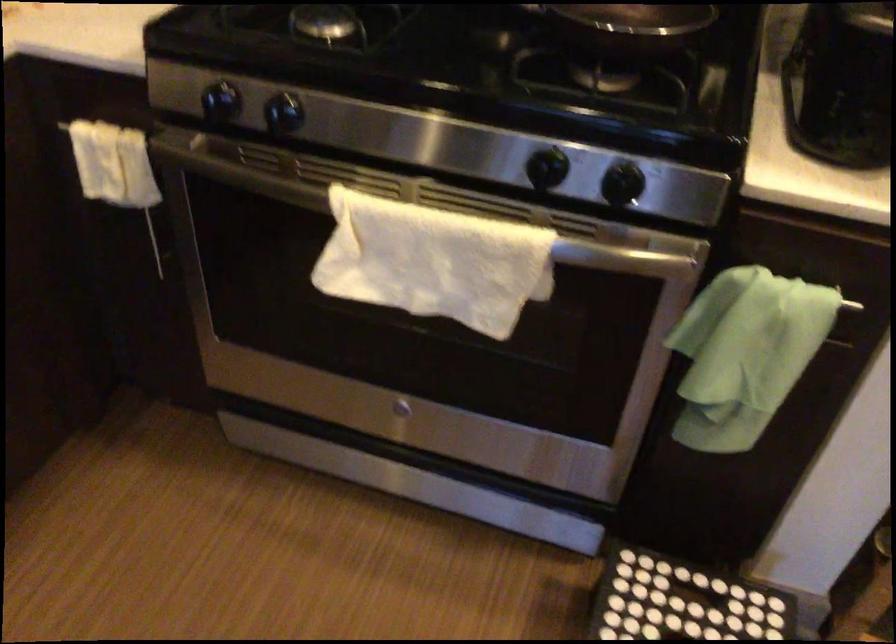
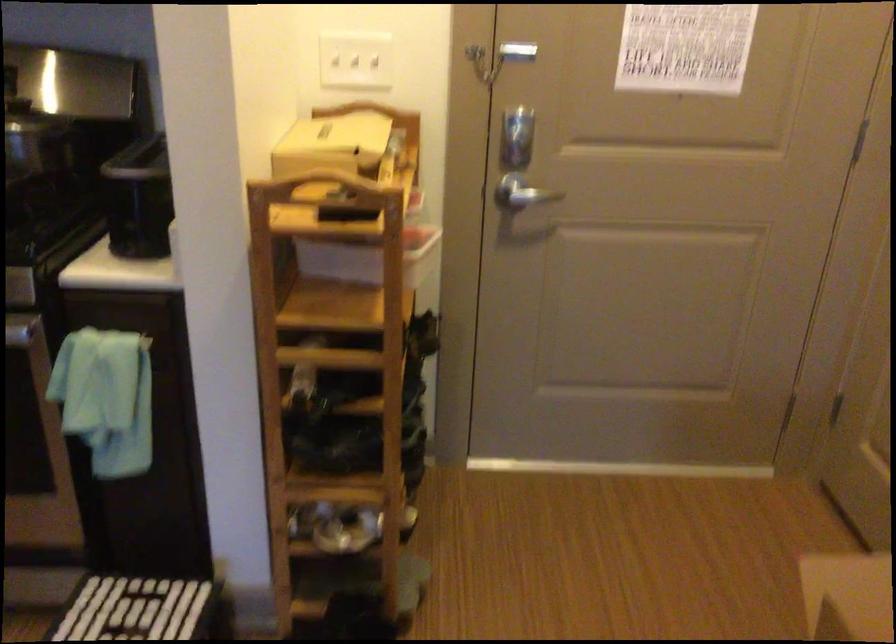
Which direction would the cameraman need to move to produce the second image?

The cameraman moved toward right, backward.